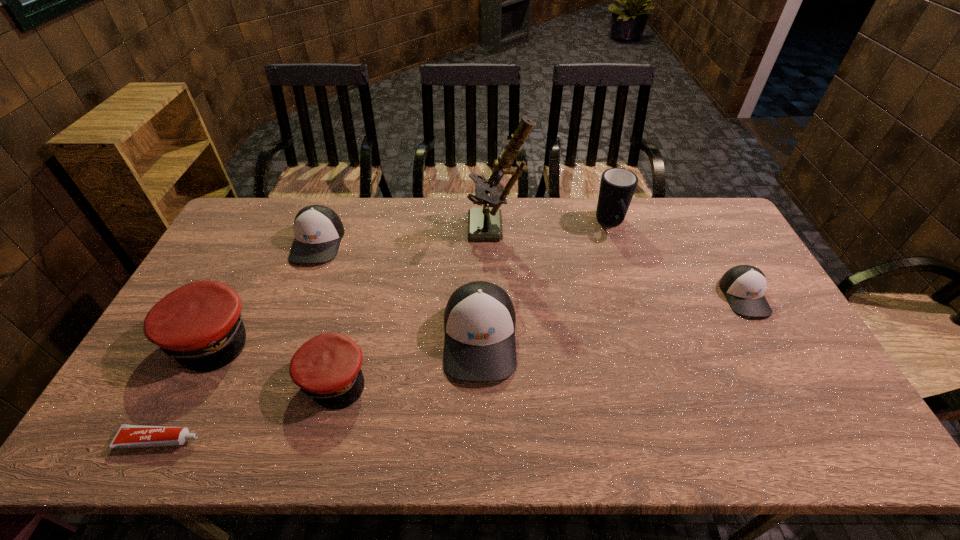
The height and width of the screenshot is (540, 960). I want to click on the rightmost cap, so click(744, 286).

Locate an element on the screen. This screenshot has height=540, width=960. the rightmost object is located at coordinates (744, 286).

Where is `the smaller red cap`? The image size is (960, 540). the smaller red cap is located at coordinates (327, 368).

At what (x,y) coordinates should I click in order to perform the action: click on the right red cap. Please return your answer as a coordinate pair (x, y). This screenshot has width=960, height=540. Looking at the image, I should click on (327, 368).

At what (x,y) coordinates should I click in order to perform the action: click on the nearest object. Please return your answer as a coordinate pair (x, y). The image size is (960, 540). Looking at the image, I should click on (127, 436).

The image size is (960, 540). Find the location of `the shortest object`. the shortest object is located at coordinates (127, 436).

Find the location of `vacant space situated 0.400m at the eyepiece of the tallest object`. vacant space situated 0.400m at the eyepiece of the tallest object is located at coordinates (354, 230).

Find the location of a particular element. This screenshot has width=960, height=540. vacant area situated at the eyepiece of the tallest object is located at coordinates (434, 230).

The image size is (960, 540). I want to click on vacant space located at the eyepiece of the tallest object, so click(x=372, y=230).

Locate an element on the screen. vacant space positioned 0.300m on the side of the seventh shortest object with the handle is located at coordinates (637, 306).